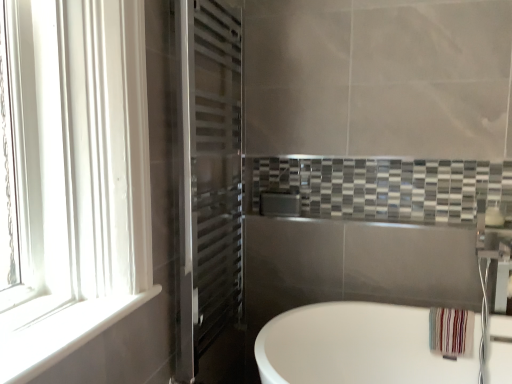
Question: Does white glossy bathtub at lower right come behind white smooth window sill at left?

Choices:
 (A) yes
 (B) no

Answer: (A)

Question: From the image's perspective, is white glossy bathtub at lower right above white smooth window sill at left?

Choices:
 (A) no
 (B) yes

Answer: (A)

Question: Is white glossy bathtub at lower right oriented away from white smooth window sill at left?

Choices:
 (A) yes
 (B) no

Answer: (B)

Question: Can you confirm if white glossy bathtub at lower right is smaller than white smooth window sill at left?

Choices:
 (A) yes
 (B) no

Answer: (B)

Question: Can you confirm if white glossy bathtub at lower right is taller than white smooth window sill at left?

Choices:
 (A) no
 (B) yes

Answer: (B)

Question: Is white glossy bathtub at lower right closer to the viewer compared to white smooth window sill at left?

Choices:
 (A) no
 (B) yes

Answer: (A)

Question: Is white glossy bathtub at lower right positioned before polished stainless steel towel rack at left?

Choices:
 (A) no
 (B) yes

Answer: (B)

Question: From a real-world perspective, is white glossy bathtub at lower right below polished stainless steel towel rack at left?

Choices:
 (A) no
 (B) yes

Answer: (B)

Question: Can you confirm if white glossy bathtub at lower right is bigger than polished stainless steel towel rack at left?

Choices:
 (A) yes
 (B) no

Answer: (A)

Question: Does white glossy bathtub at lower right have a smaller size compared to polished stainless steel towel rack at left?

Choices:
 (A) yes
 (B) no

Answer: (B)

Question: Is white glossy bathtub at lower right taller than polished stainless steel towel rack at left?

Choices:
 (A) no
 (B) yes

Answer: (A)

Question: Does white glossy bathtub at lower right appear on the left side of polished stainless steel towel rack at left?

Choices:
 (A) yes
 (B) no

Answer: (B)

Question: Does white smooth window sill at left have a lesser width compared to polished stainless steel towel rack at left?

Choices:
 (A) yes
 (B) no

Answer: (B)